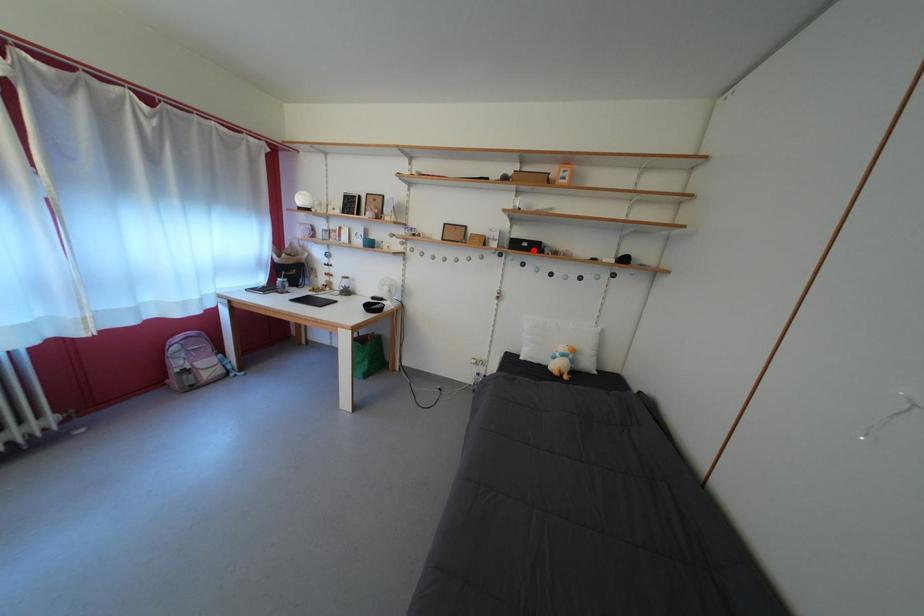
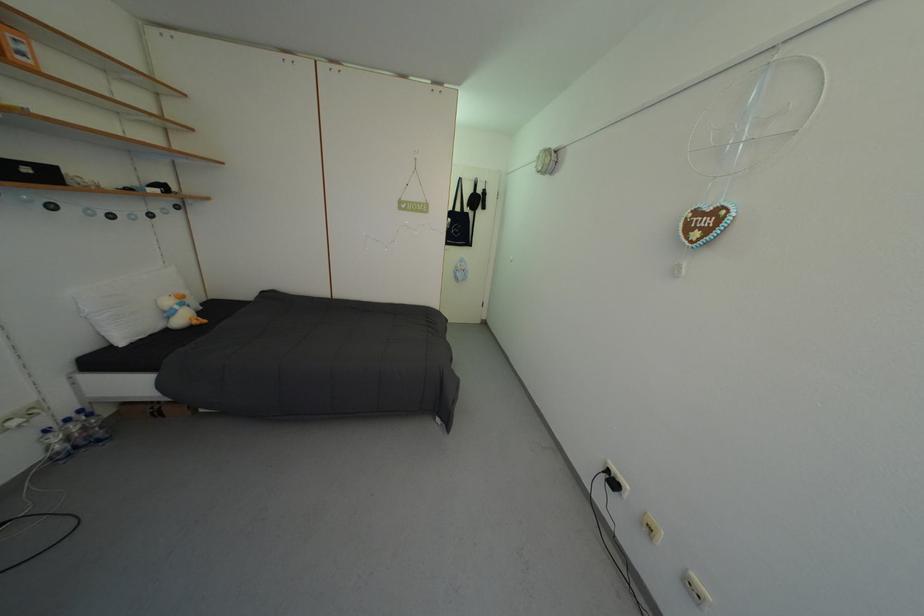
In the second image, find the point that corresponds to the highlighted location in the first image.

(35, 176)